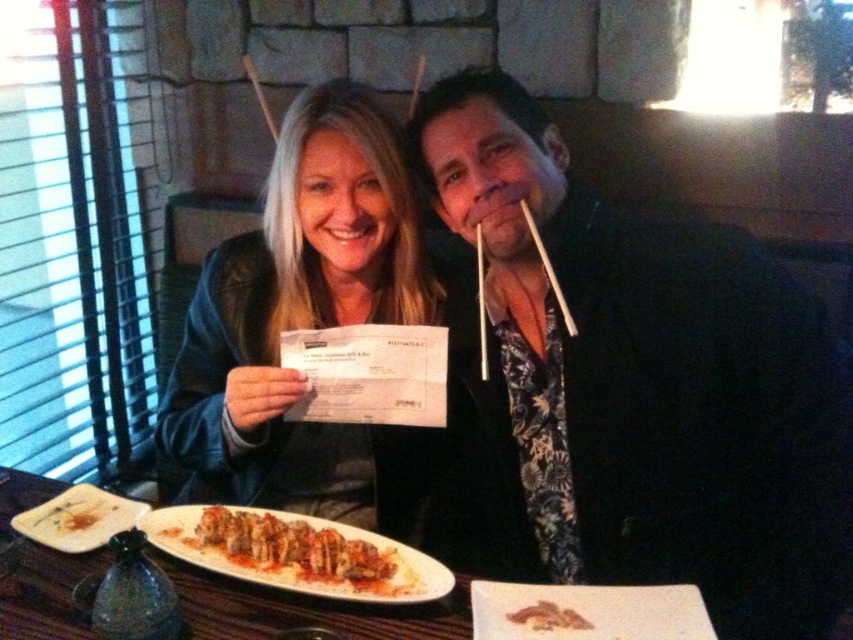
Question: Among these points, which one is nearest to the camera?

Choices:
 (A) (61, 497)
 (B) (541, 608)
 (C) (292, 524)
 (D) (432, 104)

Answer: (B)

Question: Where is matte black jacket at center located in relation to brown crispy sushi at center in the image?

Choices:
 (A) right
 (B) left

Answer: (B)

Question: Is matte black jacket at center further to the viewer compared to brown crumbly bread at center?

Choices:
 (A) yes
 (B) no

Answer: (A)

Question: Observing the image, what is the correct spatial positioning of matte black jacket at center in reference to brown crispy sushi at center?

Choices:
 (A) above
 (B) below

Answer: (A)

Question: Which of these objects is positioned farthest from the brown crispy sushi at center?

Choices:
 (A) golden crispy chicken at center
 (B) black floral shirt at center

Answer: (B)

Question: Among these objects, which one is farthest from the camera?

Choices:
 (A) matte black jacket at center
 (B) black floral shirt at center
 (C) brown crispy sushi at center

Answer: (A)